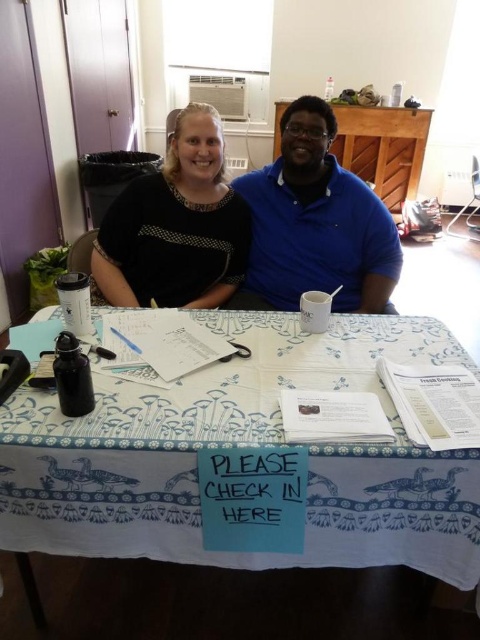
Question: Is white printed fabric at center bigger than blue cotton shirt at center?

Choices:
 (A) no
 (B) yes

Answer: (B)

Question: Estimate the real-world distances between objects in this image. Which object is farther from the blue cotton shirt at center?

Choices:
 (A) white printed fabric at center
 (B) black dotted shirt at upper left

Answer: (A)

Question: Considering the relative positions of white printed fabric at center and blue cotton shirt at center in the image provided, where is white printed fabric at center located with respect to blue cotton shirt at center?

Choices:
 (A) left
 (B) right

Answer: (A)

Question: Which object is farther from the camera taking this photo?

Choices:
 (A) white printed fabric at center
 (B) black dotted shirt at upper left

Answer: (B)

Question: Is blue cotton shirt at center thinner than black dotted shirt at upper left?

Choices:
 (A) no
 (B) yes

Answer: (A)

Question: Which object is the closest to the blue cotton shirt at center?

Choices:
 (A) black dotted shirt at upper left
 (B) white printed fabric at center

Answer: (A)